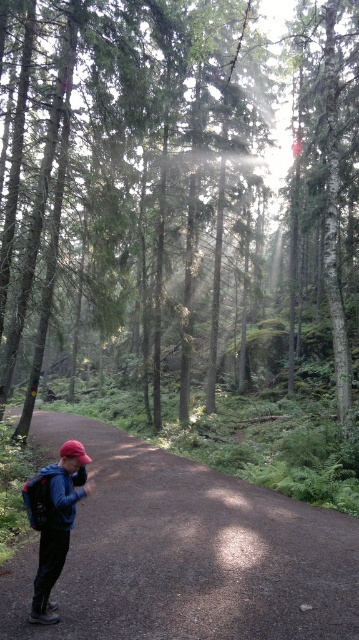
At what (x,y) coordinates should I click in order to perform the action: click on green matte tree at center. Please return your answer as a coordinate pair (x, y). The image size is (359, 640). Looking at the image, I should click on (184, 179).

Is green matte tree at center thinner than matte black backpack at lower left?

No.

The height and width of the screenshot is (640, 359). What do you see at coordinates (184, 179) in the screenshot?
I see `green matte tree at center` at bounding box center [184, 179].

I want to click on green matte tree at center, so click(x=184, y=179).

Does green matte tree at center have a lesser width compared to brown dirt trail at lower center?

No.

Does point (96, 17) lie in front of point (257, 545)?

No, (96, 17) is further to viewer.

This screenshot has width=359, height=640. I want to click on green matte tree at center, so click(184, 179).

From the picture: Between brown dirt trail at lower center and matte blue jacket at lower left, which one is positioned higher?

matte blue jacket at lower left

Which is behind, point (123, 588) or point (48, 556)?

Point (123, 588)

The image size is (359, 640). What do you see at coordinates (185, 552) in the screenshot?
I see `brown dirt trail at lower center` at bounding box center [185, 552].

Where is `brown dirt trail at lower center`? The width and height of the screenshot is (359, 640). brown dirt trail at lower center is located at coordinates (185, 552).